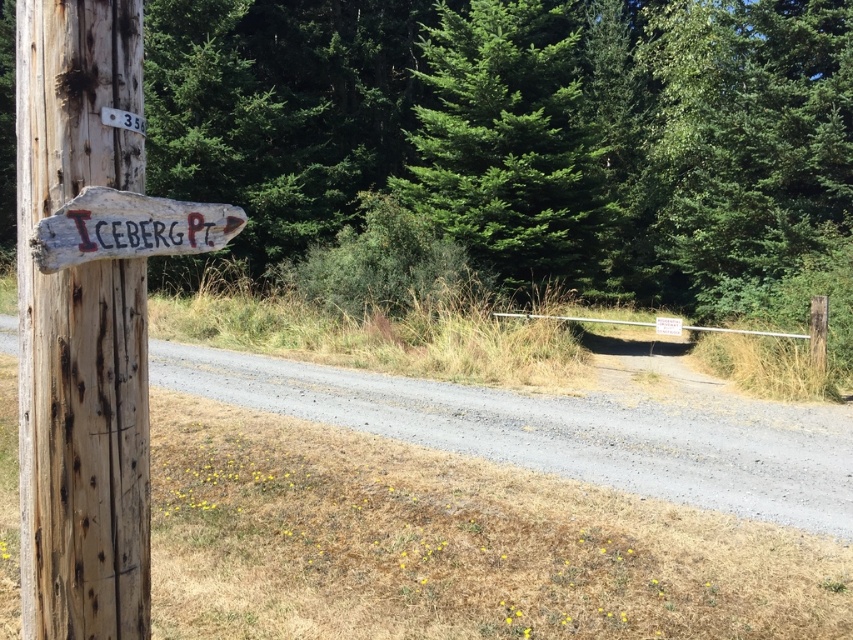
You are standing at the point marked as point [509,145]. Looking around, you see a green evergreen tree at center. Which direction should you walk to reach the wooden utility pole on the left side?

Since the green evergreen tree at center is located at point [509,145] and the wooden utility pole is on the left side, you should walk to the left to reach it.

You are a hiker who just arrived at the gravel road near the wooden utility pole. You need to place a 30 cm long hiking pole between the weathered wood sign at left and the white painted wood at upper left. Is there enough space for the hiking pole?

The distance between the weathered wood sign at left and the white painted wood at upper left is 25.19 centimeters. Since the hiking pole is 30 cm long, it would not fit in the available space.